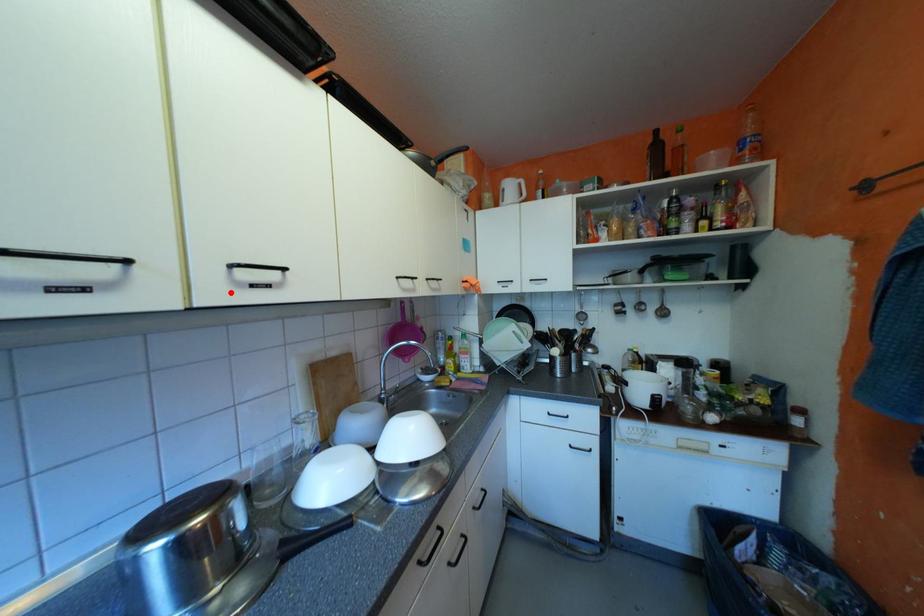
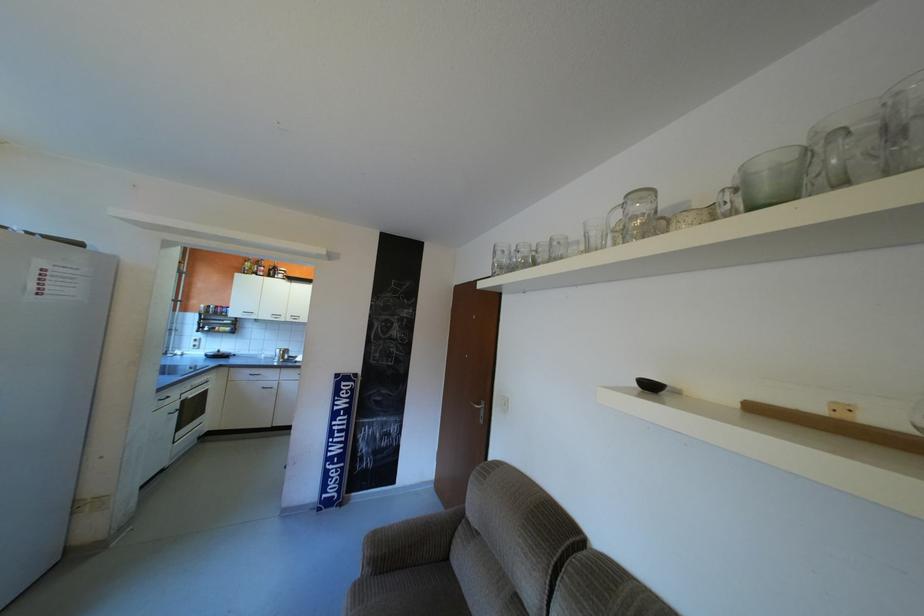
Find the pixel in the second image that matches the highlighted location in the first image.

(300, 318)